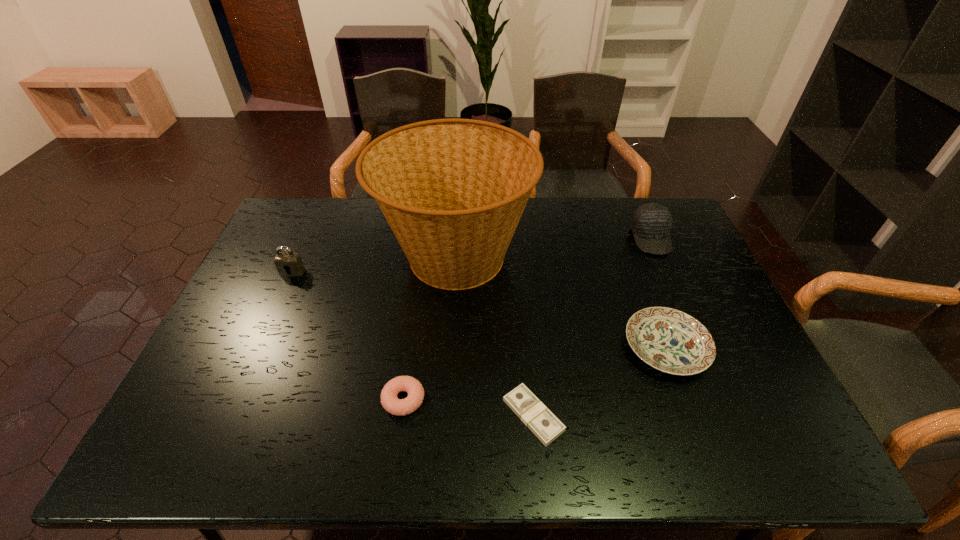
The width and height of the screenshot is (960, 540). What are the coordinates of `free spot between the doughnut and the padlock` in the screenshot? It's located at (348, 336).

This screenshot has width=960, height=540. I want to click on unoccupied position between the baseball cap and the shortest object, so click(x=592, y=327).

Where is `free space between the tallest object and the shortest object`? free space between the tallest object and the shortest object is located at coordinates (494, 336).

Locate an element on the screen. object that stands as the fourth closest to the plate is located at coordinates click(400, 407).

This screenshot has width=960, height=540. What are the coordinates of `object that can be found as the second closest to the baseball cap` in the screenshot? It's located at (453, 191).

Where is `blank space that satisfies the following two spatial constraints: 1. at the front of the leftmost object near the keyhole; 2. on the left side of the doughnut`? Image resolution: width=960 pixels, height=540 pixels. blank space that satisfies the following two spatial constraints: 1. at the front of the leftmost object near the keyhole; 2. on the left side of the doughnut is located at coordinates (235, 400).

What are the coordinates of `free spot that satisfies the following two spatial constraints: 1. on the front side of the basket; 2. on the left side of the plate` in the screenshot? It's located at (449, 348).

At what (x,y) coordinates should I click in order to perform the action: click on vacant space that satisfies the following two spatial constraints: 1. on the back side of the tallest object; 2. on the left side of the doughnut. Please return your answer as a coordinate pair (x, y). This screenshot has width=960, height=540. Looking at the image, I should click on (423, 258).

You are a GUI agent. You are given a task and a screenshot of the screen. Output one action in this format:
    pyautogui.click(x=<x>, y=<y>)
    Task: Click on the vacant space that satisfies the following two spatial constraints: 1. on the back side of the tallest object; 2. on the right side of the doughnut
    Image resolution: width=960 pixels, height=540 pixels.
    Given the screenshot: What is the action you would take?
    click(x=423, y=258)